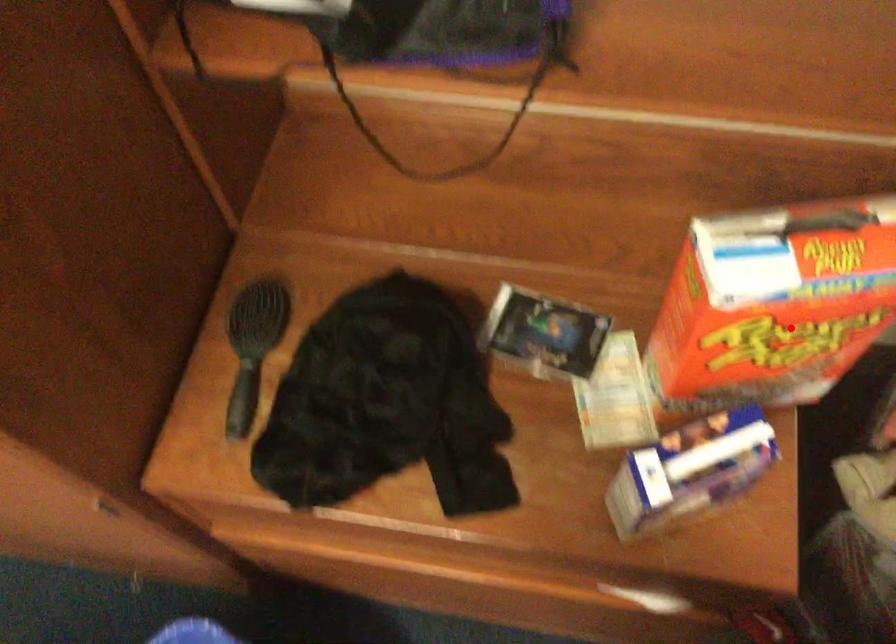
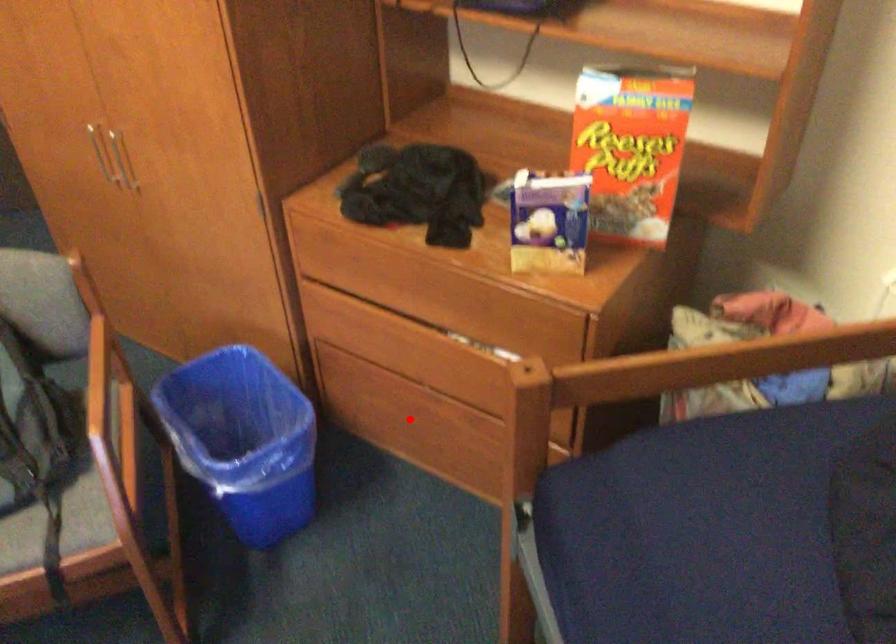
I am providing you with two images of the same scene from different viewpoints. A red point is marked on the first image and another point is marked on the second image. Does the point marked in image1 correspond to the same location as the one in image2?

No